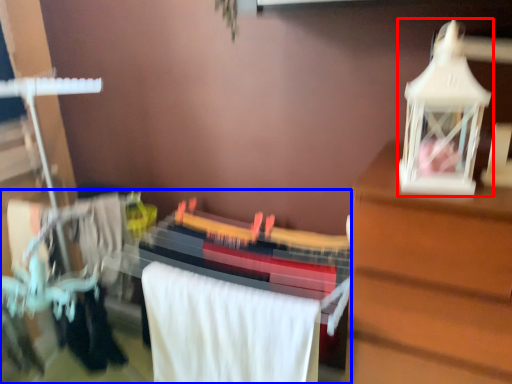
Question: Which point is further to the camera, toy (highlighted by a red box) or closet (highlighted by a blue box)?

Choices:
 (A) toy
 (B) closet

Answer: (B)